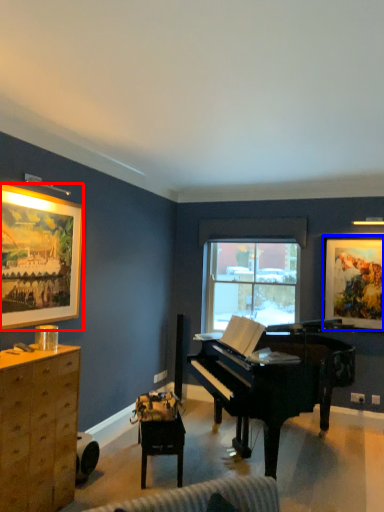
Question: Which object appears closest to the camera in this image, picture frame (highlighted by a red box) or picture frame (highlighted by a blue box)?

Choices:
 (A) picture frame
 (B) picture frame

Answer: (A)